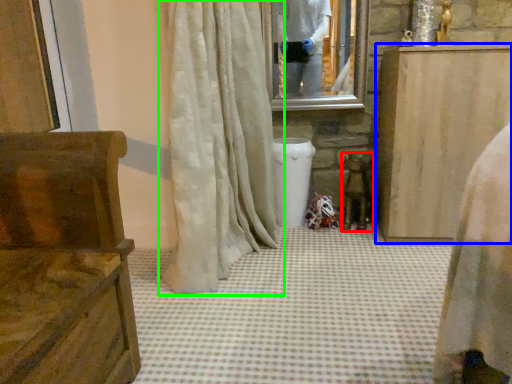
Question: Which object is positioned farthest from chair (highlighted by a red box)? Select from furniture (highlighted by a blue box) and curtain (highlighted by a green box).

Choices:
 (A) furniture
 (B) curtain

Answer: (B)